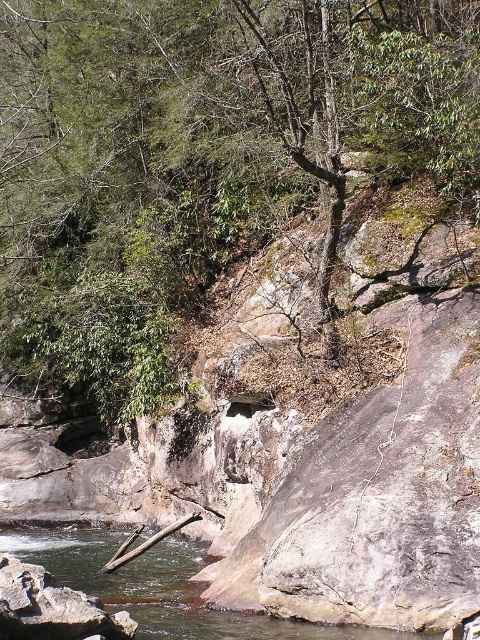
Question: Does green leafy tree at upper center appear over clear water at stream center?

Choices:
 (A) yes
 (B) no

Answer: (A)

Question: Observing the image, what is the correct spatial positioning of green leafy tree at upper center in reference to clear water at stream center?

Choices:
 (A) above
 (B) below

Answer: (A)

Question: Which point appears farthest from the camera in this image?

Choices:
 (A) (169, 564)
 (B) (176, 80)

Answer: (B)

Question: Is green leafy tree at upper center positioned at the back of clear water at stream center?

Choices:
 (A) yes
 (B) no

Answer: (A)